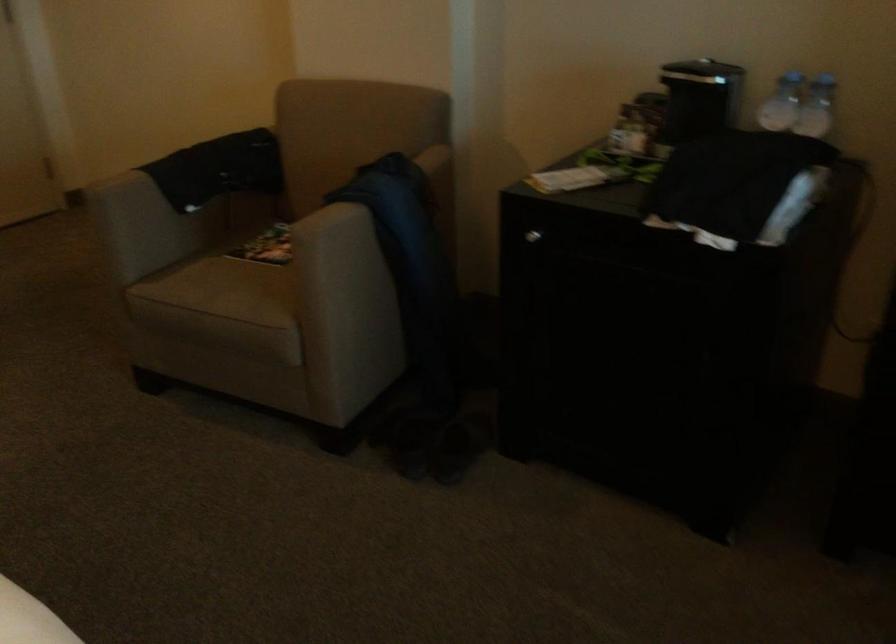
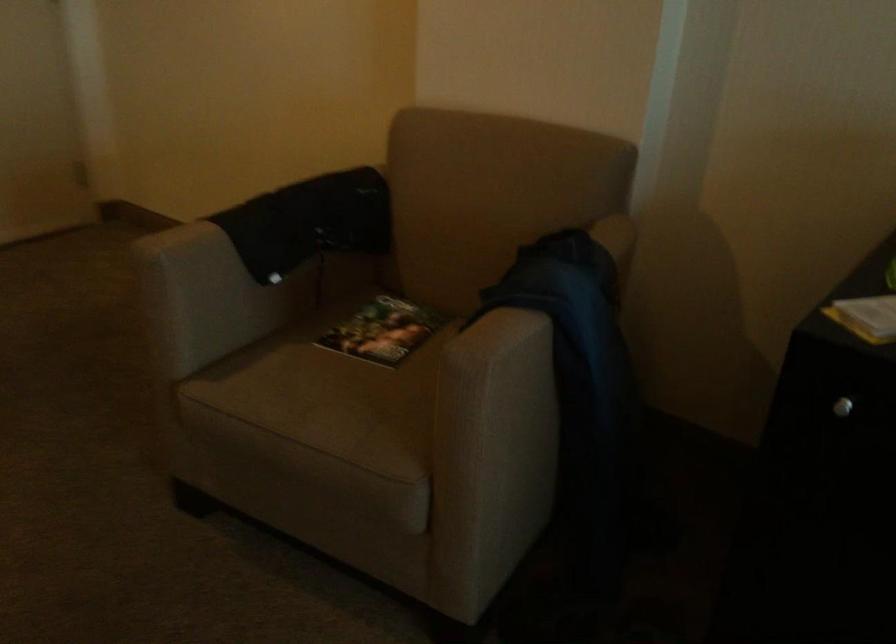
In the second image, find the point that corresponds to (x=382, y=172) in the first image.

(564, 261)